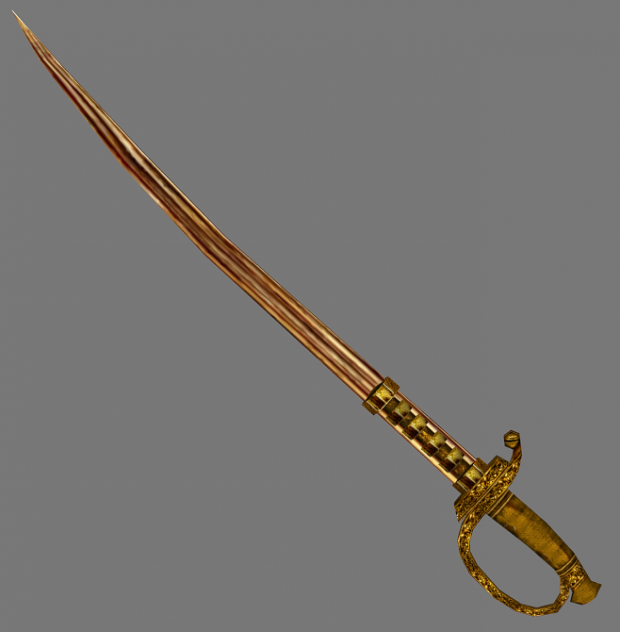
The height and width of the screenshot is (632, 620). In order to click on handle in this screenshot , I will do `click(489, 586)`.